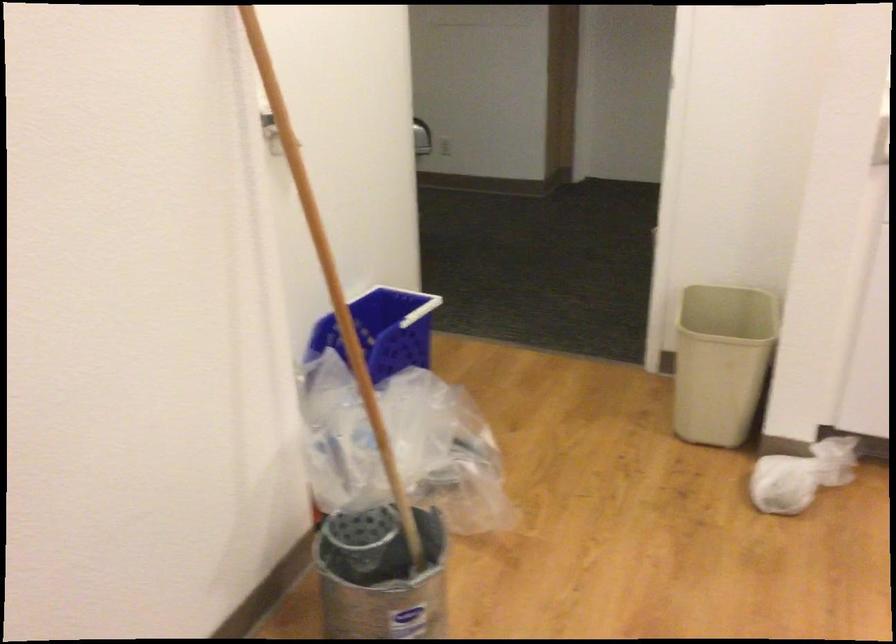
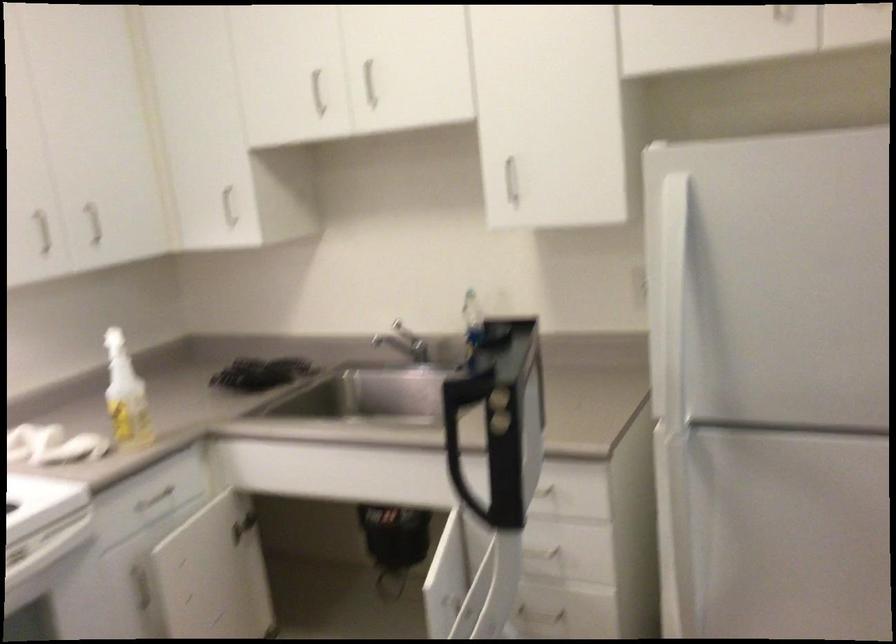
Question: The first image is from the beginning of the video and the second image is from the end. How did the camera likely rotate when shooting the video?

Choices:
 (A) Left
 (B) Right
 (C) Up
 (D) Down

Answer: (B)